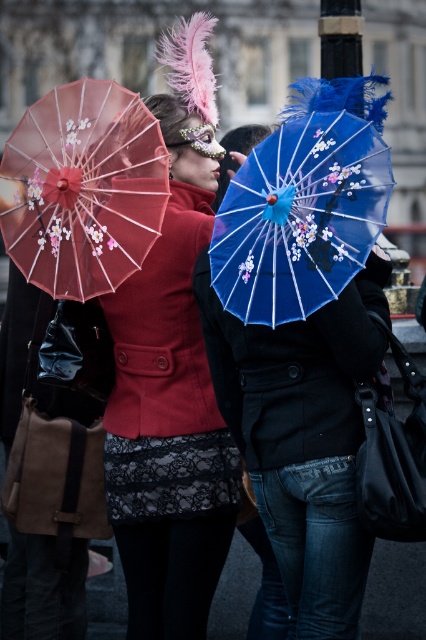
You are a photographer trying to capture both the matte pink parasol at left and the blue glossy parasol at center in a single frame. Given their sizes, which parasol will appear bigger in the photo?

The matte pink parasol at left will appear bigger in the photo because it is larger in size than the blue glossy parasol at center.